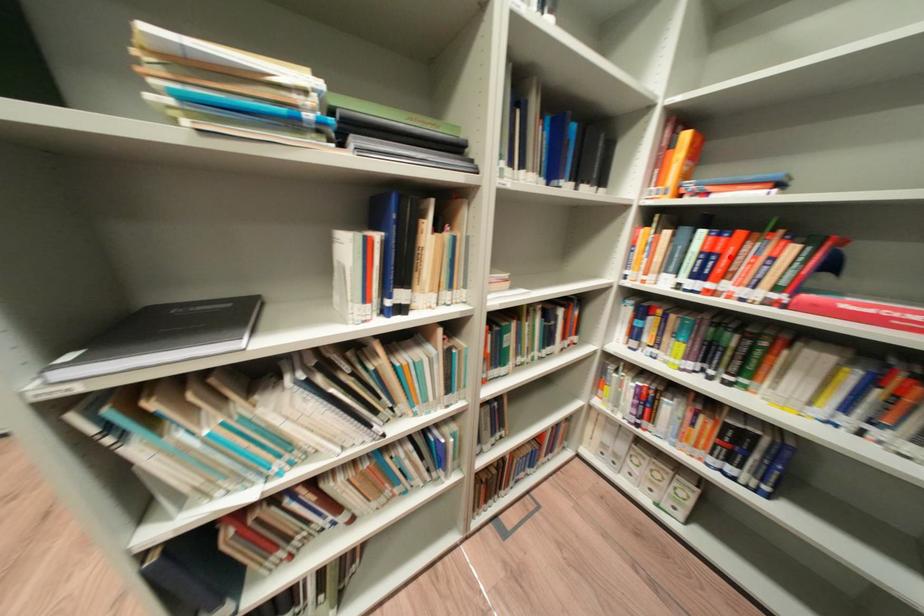
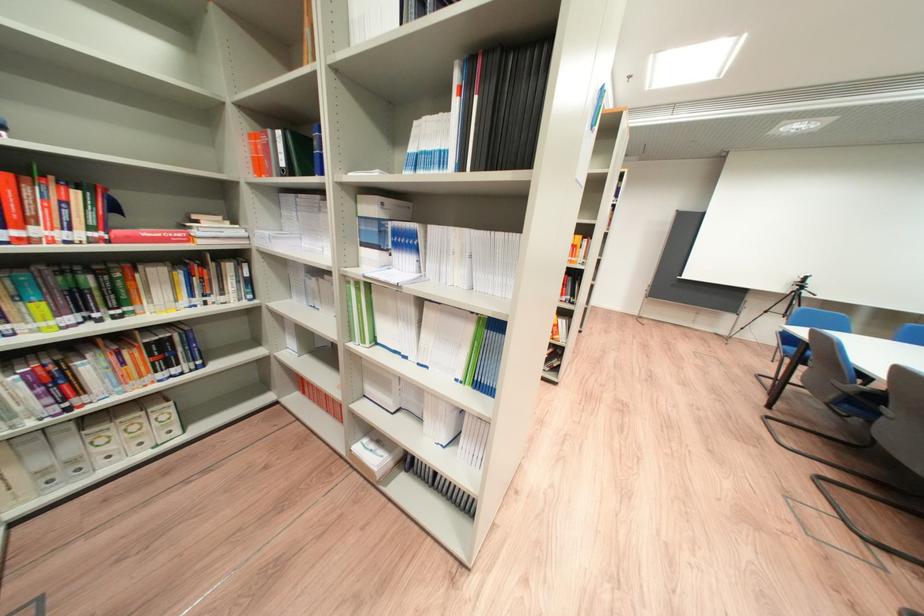
Question: I am providing you with two images of the same scene from different viewpoints. In image1, a red point is highlighted. Considering the same 3D point in image2, which of the following is correct?

Choices:
 (A) It is closer
 (B) It is farther

Answer: (B)